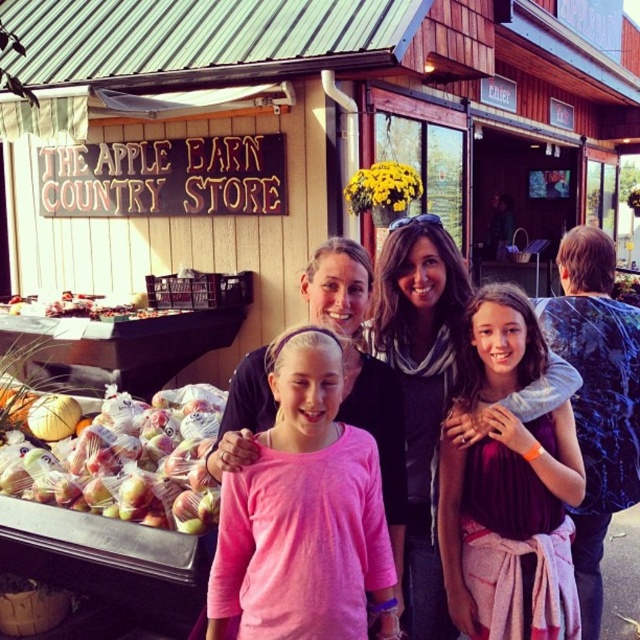
Question: Which point appears farthest from the camera in this image?

Choices:
 (A) (264, 625)
 (B) (51, 298)

Answer: (B)

Question: Is pink cotton shirt at center thinner than black scarf at center?

Choices:
 (A) yes
 (B) no

Answer: (B)

Question: Which object appears closest to the camera in this image?

Choices:
 (A) pink fabric shirt at center
 (B) pink fabric at center

Answer: (B)

Question: Which point appears farthest from the camera in this image?

Choices:
 (A) [x=444, y=372]
 (B) [x=481, y=528]
 (C) [x=417, y=241]

Answer: (A)

Question: Does pink fabric shirt at center have a larger size compared to translucent plastic bags of apples at lower left?

Choices:
 (A) no
 (B) yes

Answer: (A)

Question: Does pink fabric shirt at center lie behind black scarf at center?

Choices:
 (A) yes
 (B) no

Answer: (A)